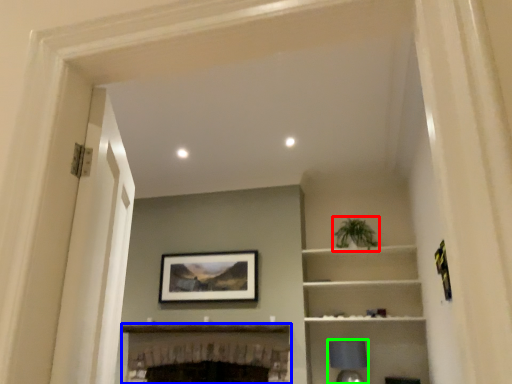
Question: Which object is the closest to the plant (highlighted by a red box)? Choose among these: fireplace (highlighted by a blue box) or lamp (highlighted by a green box).

Choices:
 (A) fireplace
 (B) lamp

Answer: (B)